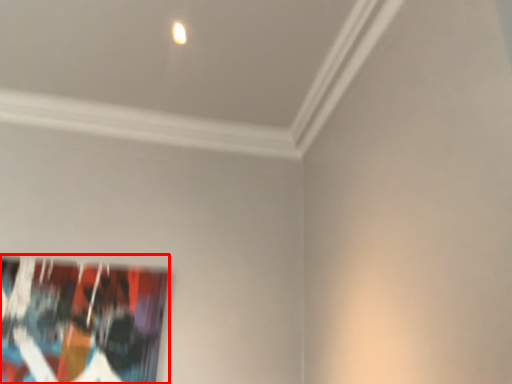
Question: Where is picture frame (annotated by the red box) located in relation to light in the image?

Choices:
 (A) left
 (B) right

Answer: (A)